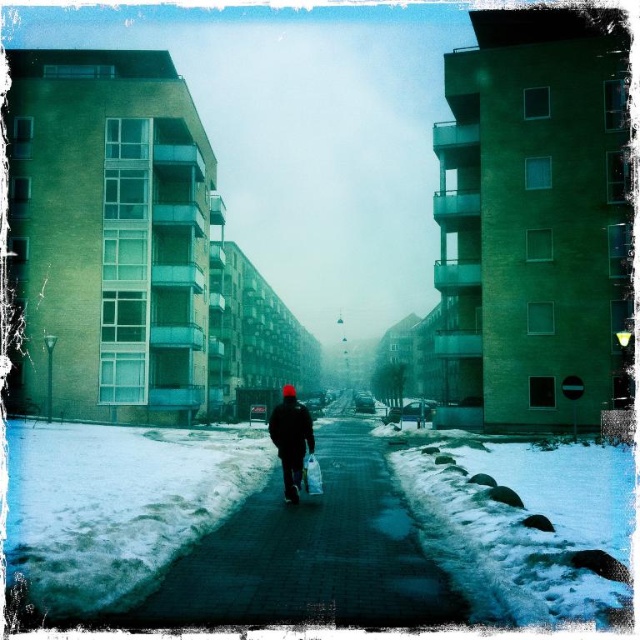
Question: Which of the following is the closest to the observer?

Choices:
 (A) (262, 516)
 (B) (308, 426)

Answer: (A)

Question: Does smooth concrete pavement at center lie in front of dark matte jacket at center?

Choices:
 (A) no
 (B) yes

Answer: (B)

Question: Estimate the real-world distances between objects in this image. Which object is farther from the dark blue textured jacket at center?

Choices:
 (A) dark matte jacket at center
 (B) smooth concrete pavement at center

Answer: (B)

Question: Which object is closer to the camera taking this photo?

Choices:
 (A) smooth concrete pavement at center
 (B) dark blue textured jacket at center

Answer: (A)

Question: Does dark matte jacket at center appear over dark blue textured jacket at center?

Choices:
 (A) no
 (B) yes

Answer: (A)

Question: Is smooth concrete pavement at center to the right of dark blue textured jacket at center from the viewer's perspective?

Choices:
 (A) no
 (B) yes

Answer: (B)